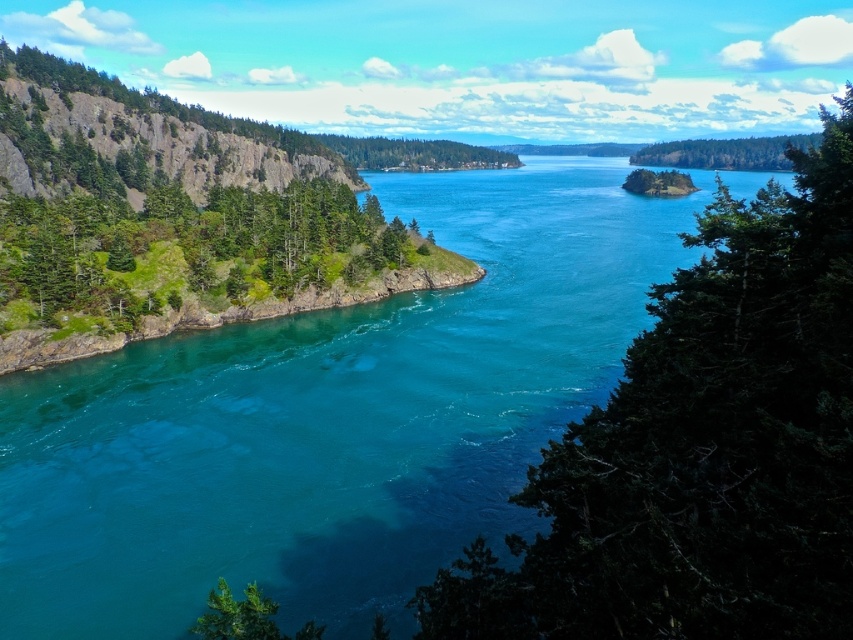
You are a hiker standing at the edge of the clear blue water at center and want to cross to the green textured tree at center right. Can you walk directly to the tree without getting wet?

The clear blue water at center is much taller than the green textured tree at center right, so the water is deeper there. You would need to find another path or use a boat to reach the green textured tree at center right without getting wet.

You are standing at the center of the image and want to locate the clear blue water at center. According to the coordinates provided, in which direction should you look to find it?

The clear blue water at center is located at coordinates point [334,419], so you should look slightly to the right and down from the center to find it.